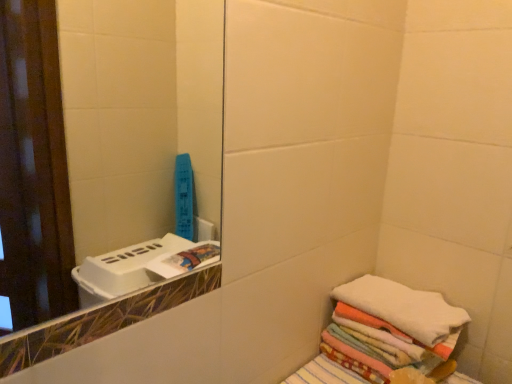
Describe the element at coordinates (403, 307) in the screenshot. The image size is (512, 384). I see `white soft towels at lower right` at that location.

Identify the location of white soft towels at lower right. (403, 307).

Where is `white soft towels at lower right`? white soft towels at lower right is located at coordinates (403, 307).